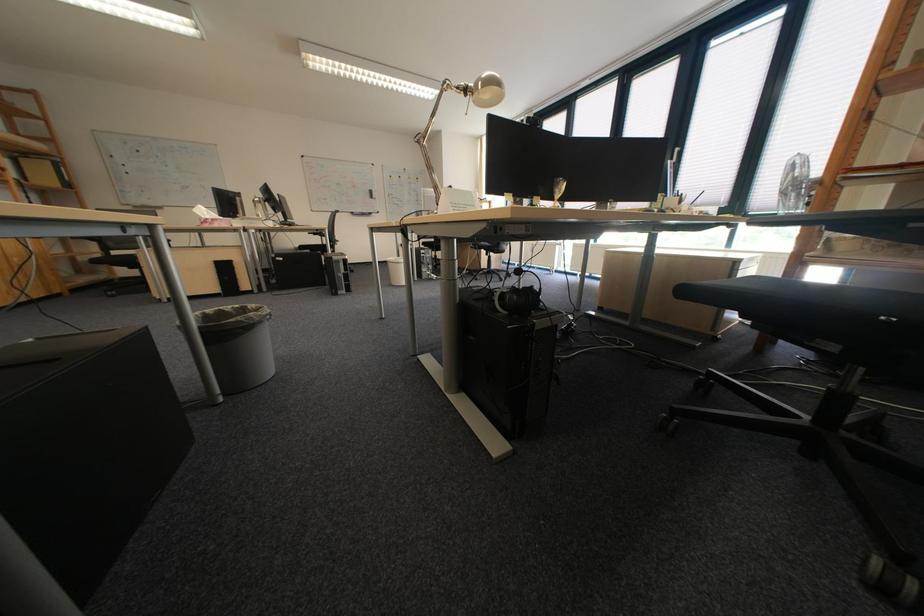
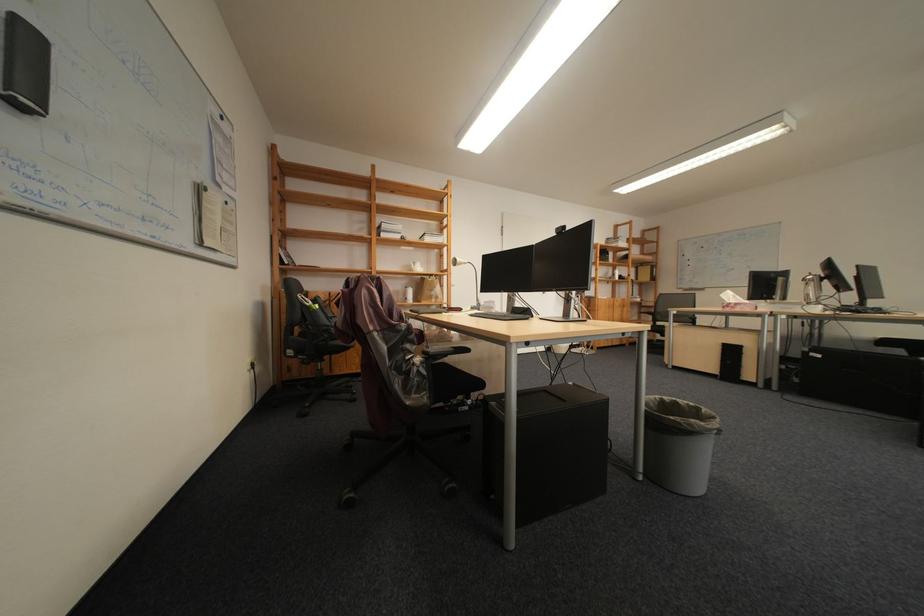
Find the pixel in the second image that matches [268,203] in the first image.

(819, 282)